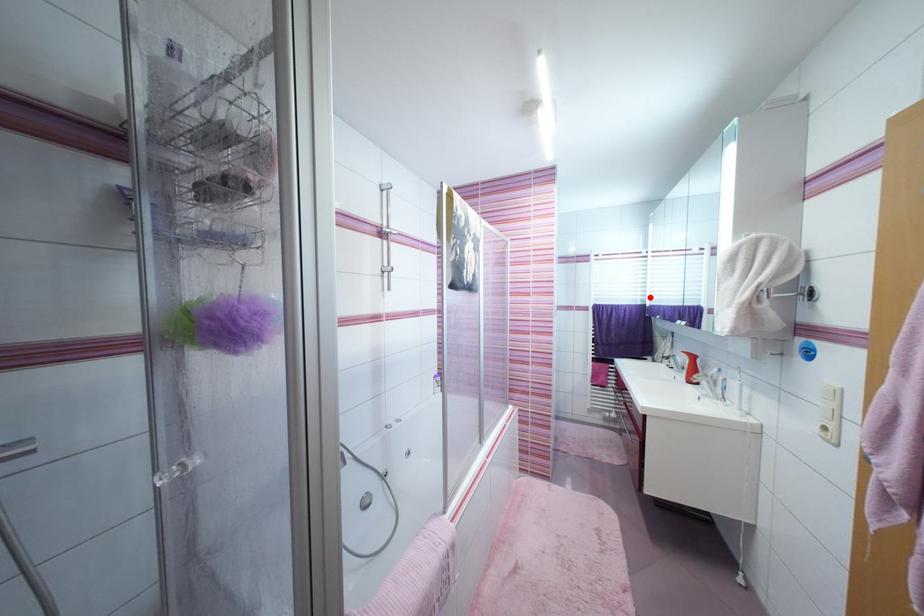
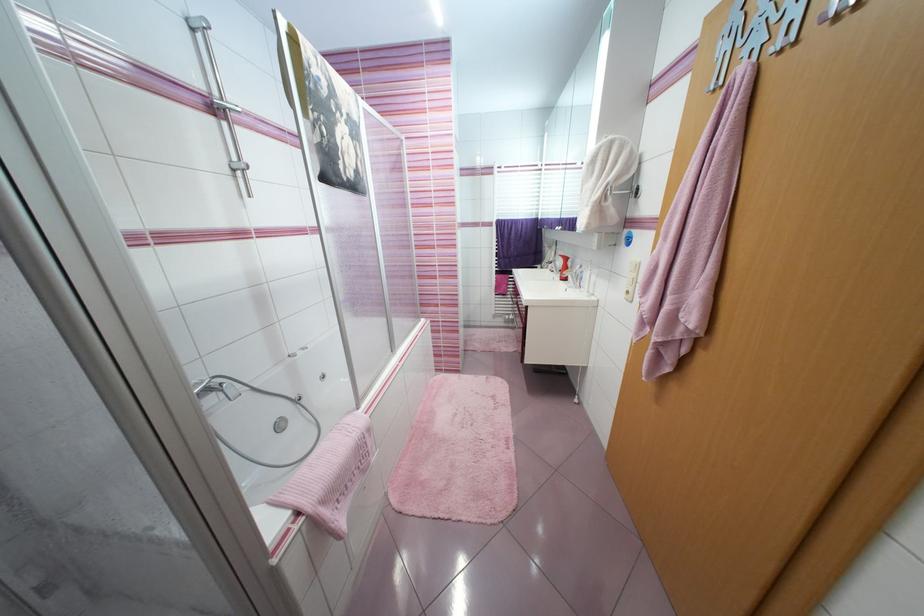
In the second image, find the point that corresponds to the highlighted location in the first image.

(543, 211)